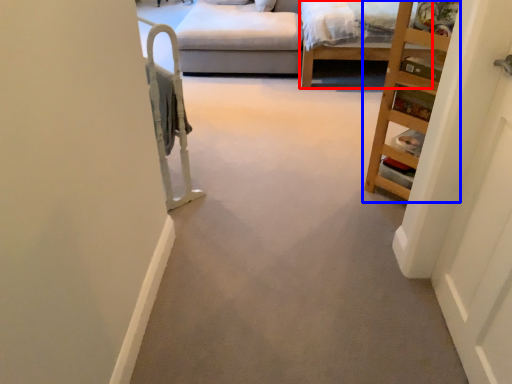
Question: Which object appears closest to the camera in this image, bed frame (highlighted by a red box) or furniture (highlighted by a blue box)?

Choices:
 (A) bed frame
 (B) furniture

Answer: (B)